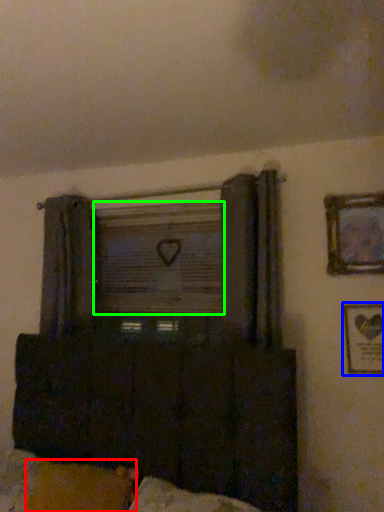
Question: Based on their relative distances, which object is nearer to pillow (highlighted by a red box)? Choose from picture frame (highlighted by a blue box) and window screen (highlighted by a green box).

Choices:
 (A) picture frame
 (B) window screen

Answer: (B)